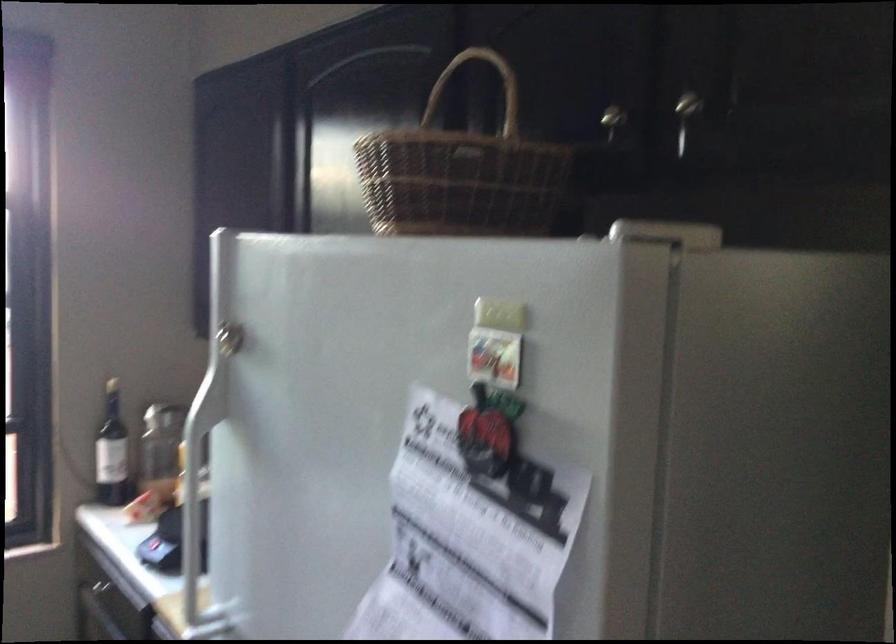
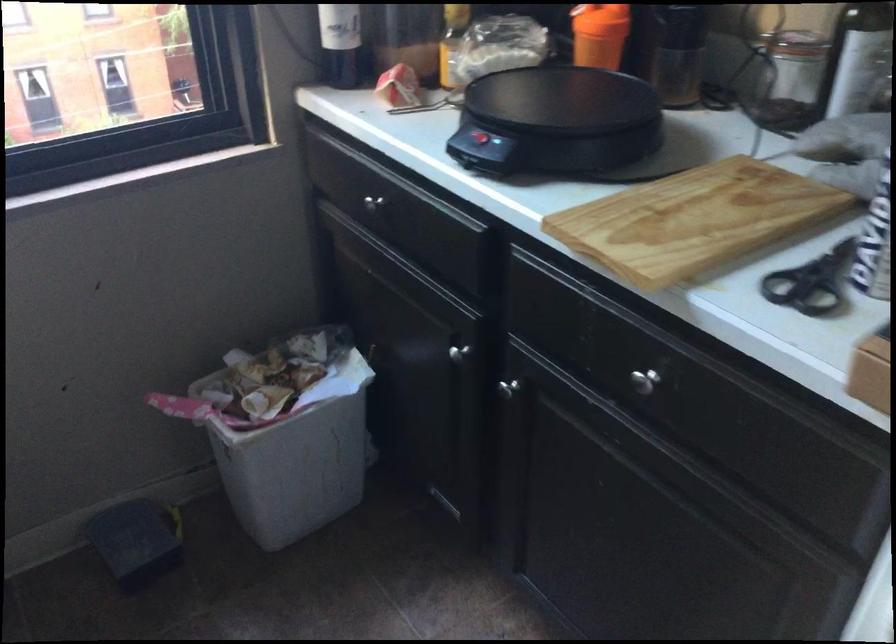
Which direction would the cameraman need to move to produce the second image?

The cameraman walked toward left, forward.